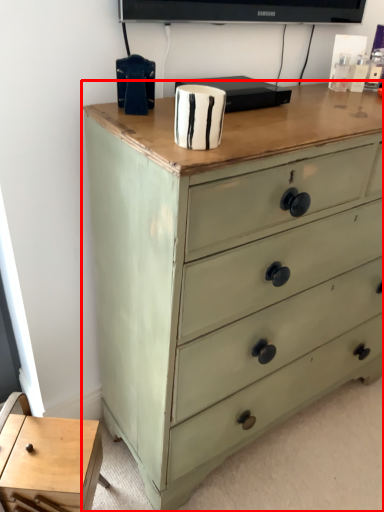
Question: From the image's perspective, where is chest of drawers (annotated by the red box) located in relation to table in the image?

Choices:
 (A) below
 (B) above

Answer: (B)